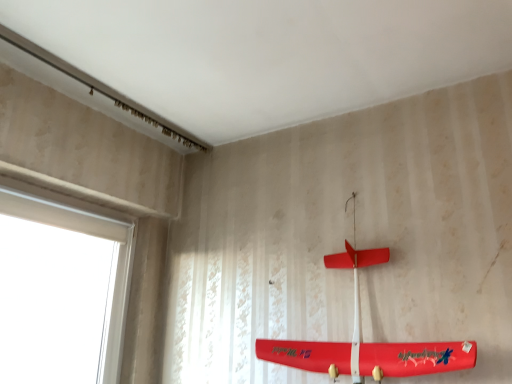
What do you see at coordinates (366, 343) in the screenshot? I see `shiny red airplane at center` at bounding box center [366, 343].

Find the location of a particular element. The width and height of the screenshot is (512, 384). shiny red airplane at center is located at coordinates (366, 343).

You are a GUI agent. You are given a task and a screenshot of the screen. Output one action in this format:
    pyautogui.click(x=<x>, y=<y>)
    Task: Click on the shiny red airplane at center
    
    Given the screenshot: What is the action you would take?
    tap(366, 343)